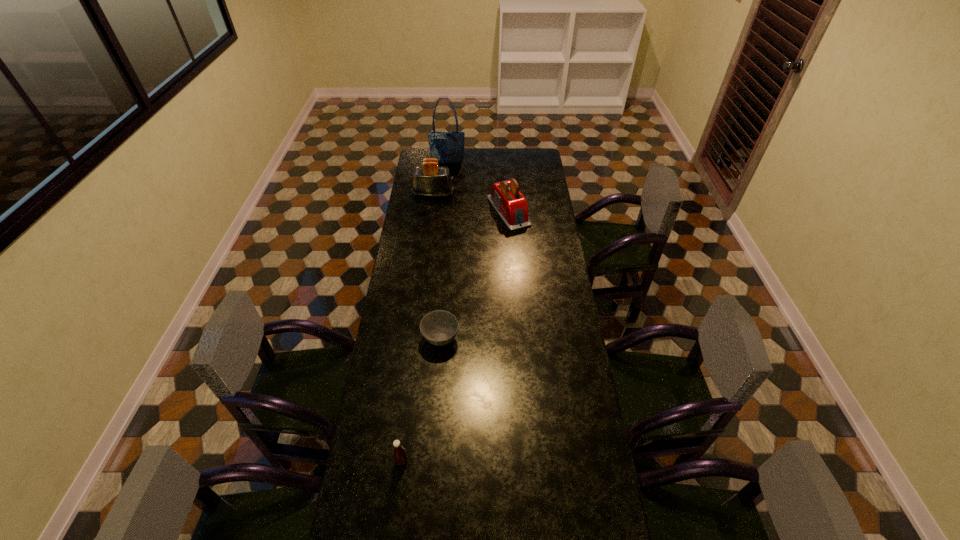
Identify the location of shopping bag. This screenshot has height=540, width=960. (447, 147).

You are a GUI agent. You are given a task and a screenshot of the screen. Output one action in this format:
    pyautogui.click(x=<x>, y=<y>)
    Task: Click on the tallest object
    
    Given the screenshot: What is the action you would take?
    pyautogui.click(x=447, y=147)

The height and width of the screenshot is (540, 960). I want to click on the left toaster, so click(x=430, y=180).

Locate an element on the screen. This screenshot has height=540, width=960. the right toaster is located at coordinates (507, 200).

The image size is (960, 540). In order to click on the fourth tallest object in this screenshot , I will do `click(399, 452)`.

Identify the location of the nearest object. The image size is (960, 540). (399, 452).

I want to click on the fourth farthest object, so click(x=439, y=327).

Identify the location of the shortest object. This screenshot has height=540, width=960. (439, 327).

Image resolution: width=960 pixels, height=540 pixels. In order to click on vacant space located 0.210m on the front-facing side of the farthest object in this screenshot , I will do `click(445, 186)`.

Identify the location of vacant area located on the side of the left toaster with the control lever. This screenshot has width=960, height=540. (496, 194).